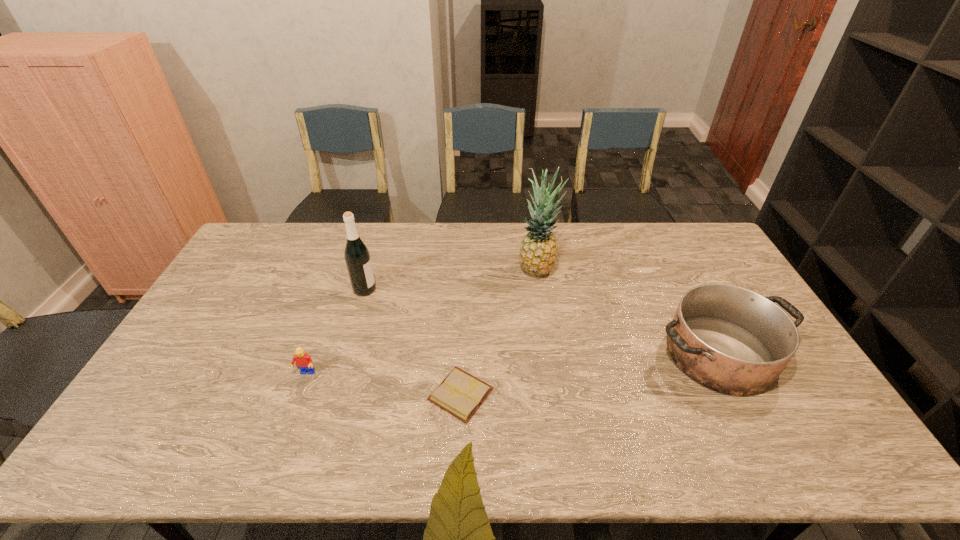
Locate an element on the screen. This screenshot has height=540, width=960. empty location between the third object from right to left and the pineapple is located at coordinates (499, 332).

This screenshot has width=960, height=540. I want to click on free spot between the third object from left to right and the second tallest object, so click(x=413, y=342).

I want to click on free space between the second shortest object and the diary, so (383, 384).

The width and height of the screenshot is (960, 540). I want to click on unoccupied area between the fourth object from right to left and the third tallest object, so click(541, 321).

This screenshot has height=540, width=960. In order to click on free spot between the saucepan and the leftmost object in this screenshot , I will do `click(513, 364)`.

Identify the location of free space that is in between the saucepan and the shortest object. This screenshot has width=960, height=540. (590, 374).

Image resolution: width=960 pixels, height=540 pixels. Identify the location of vacant region between the third object from right to left and the fourth object from right to left. (413, 342).

What are the coordinates of `empty space that is in between the fourth object from right to left and the leftmost object` in the screenshot? It's located at (335, 332).

The width and height of the screenshot is (960, 540). I want to click on unoccupied position between the leftmost object and the wine bottle, so click(x=335, y=332).

I want to click on vacant region between the third object from right to left and the fourth object from right to left, so click(x=413, y=342).